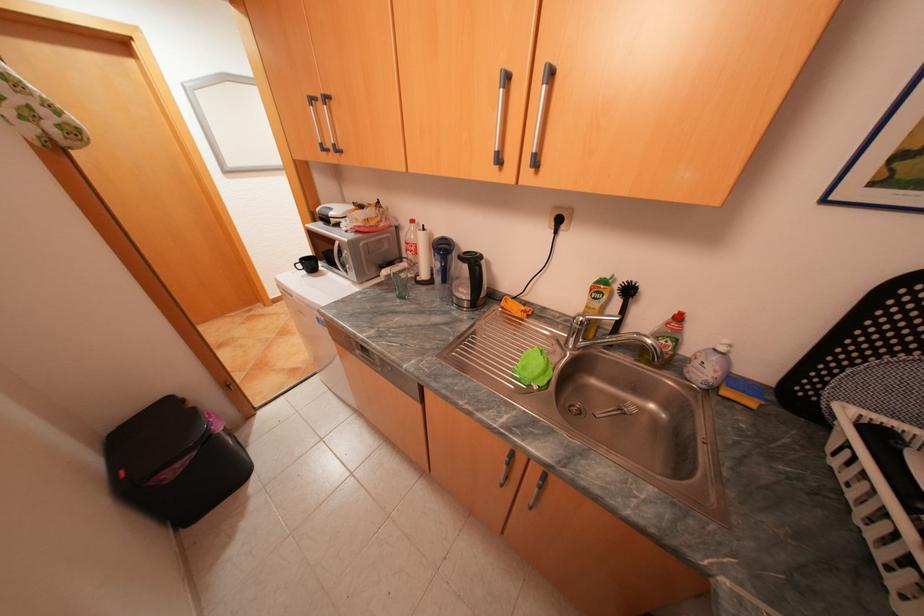
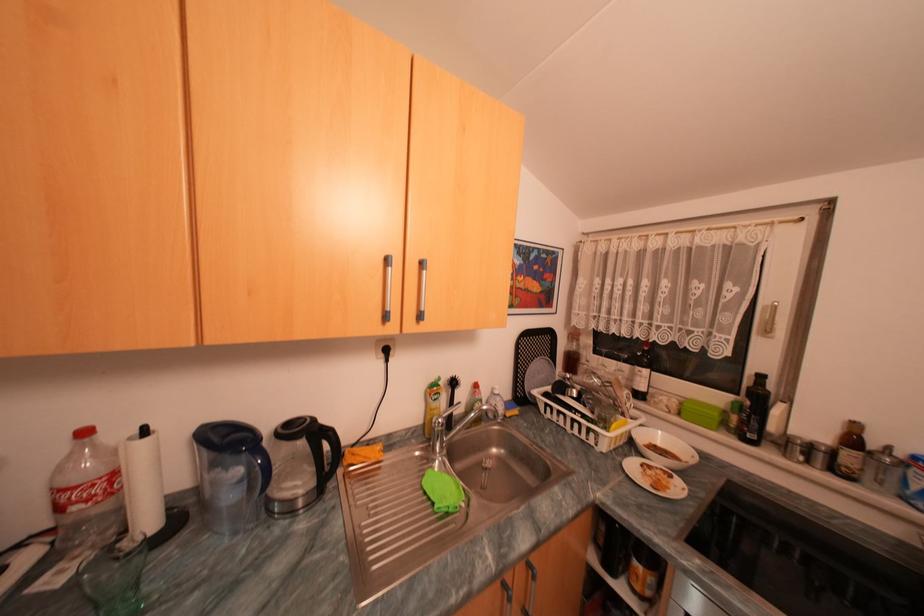
Where in the second image is the point corresponding to pixel 421 221 from the first image?

(94, 432)